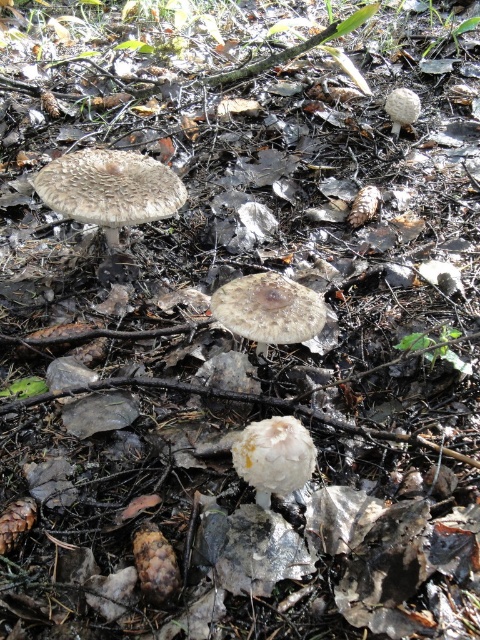
Is white fuzzy mushroom at upper left further to the viewer compared to brown textured mushroom at center?

Yes.

Which is below, white fuzzy mushroom at upper left or brown textured mushroom at center?

Positioned lower is brown textured mushroom at center.

What do you see at coordinates (109, 188) in the screenshot? This screenshot has width=480, height=640. I see `white fuzzy mushroom at upper left` at bounding box center [109, 188].

Find the location of `white fuzzy mushroom at upper left`. white fuzzy mushroom at upper left is located at coordinates (109, 188).

Does brown textured mushroom at center have a smaller size compared to white fuzzy mushroom at center?

No.

Which is below, brown textured mushroom at center or white fuzzy mushroom at center?

Positioned lower is white fuzzy mushroom at center.

Is point (266, 312) positioned behind point (299, 483)?

Yes, point (266, 312) is farther from viewer.

Where is `brown textured mushroom at center`? brown textured mushroom at center is located at coordinates (268, 308).

Between point (301, 445) and point (414, 102), which one is positioned behind?

The point (414, 102) is more distant.

Is white fuzzy mushroom at center smaller than white fuzzy mushroom at upper right?

Indeed, white fuzzy mushroom at center has a smaller size compared to white fuzzy mushroom at upper right.

Which is behind, point (257, 461) or point (393, 99)?

Positioned behind is point (393, 99).

At what (x,y) coordinates should I click in order to perform the action: click on white fuzzy mushroom at center. Please return your answer as a coordinate pair (x, y). The width and height of the screenshot is (480, 640). Looking at the image, I should click on (274, 456).